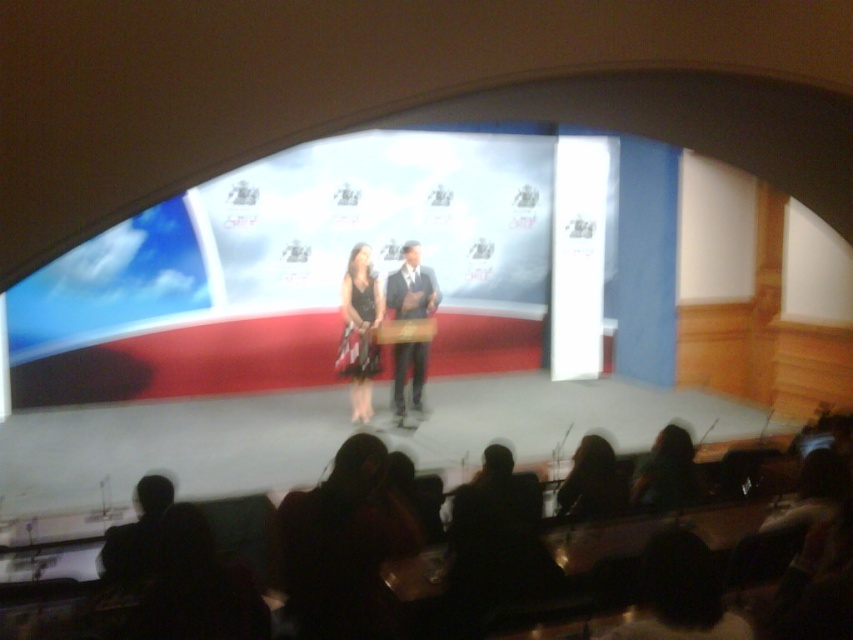
Question: Can you confirm if black satin dress at center is bigger than green matte dress at lower right?

Choices:
 (A) no
 (B) yes

Answer: (B)

Question: Is black satin dress at center below silky brown hair at lower center?

Choices:
 (A) no
 (B) yes

Answer: (A)

Question: Estimate the real-world distances between objects in this image. Which object is farther from the black satin dress at center?

Choices:
 (A) green matte dress at lower right
 (B) white glossy projection screen at center
 (C) silky brown hair at lower center

Answer: (A)

Question: Which point is farther to the camera?

Choices:
 (A) green matte dress at lower right
 (B) white glossy projection screen at center
 (C) dark suit at center
 (D) black satin dress at center

Answer: (B)

Question: Can you confirm if dark suit at center is wider than silky brown hair at lower center?

Choices:
 (A) no
 (B) yes

Answer: (B)

Question: Which of the following is the farthest from the observer?

Choices:
 (A) silky brown hair at lower center
 (B) black satin dress at center

Answer: (B)